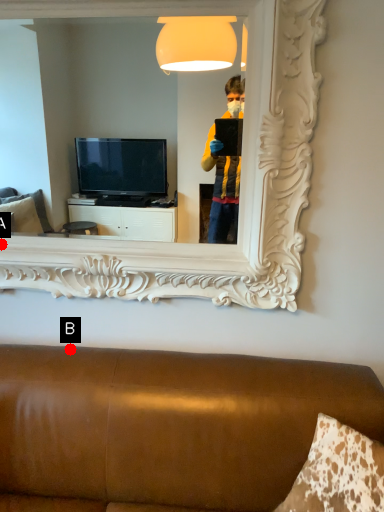
Question: Two points are circled on the image, labeled by A and B beside each circle. Which point is closer to the camera taking this photo?

Choices:
 (A) A is closer
 (B) B is closer

Answer: (B)